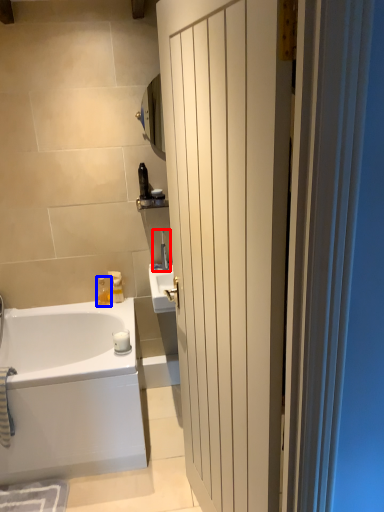
Question: Among these objects, which one is nearest to the camera, faucet (highlighted by a red box) or toiletry (highlighted by a blue box)?

Choices:
 (A) faucet
 (B) toiletry

Answer: (A)